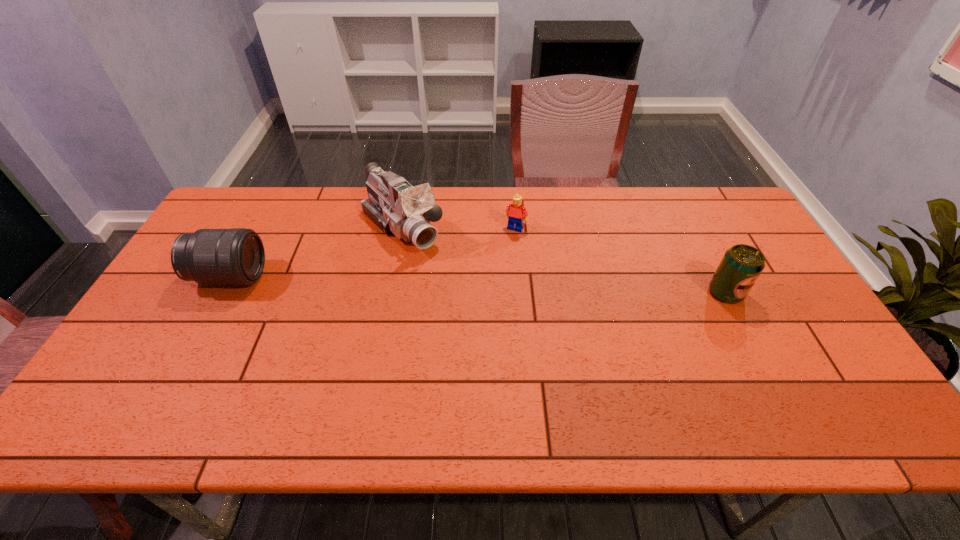
This screenshot has height=540, width=960. I want to click on free space on the desktop that is between the leftmost object and the beer can and is positioned on the front-facing side of the third object from left to right, so click(x=486, y=285).

Identify the location of vacant space on the desktop that is between the telephoto lens and the rightmost object and is positioned on the front-facing side of the third object from right to left. This screenshot has width=960, height=540. (459, 284).